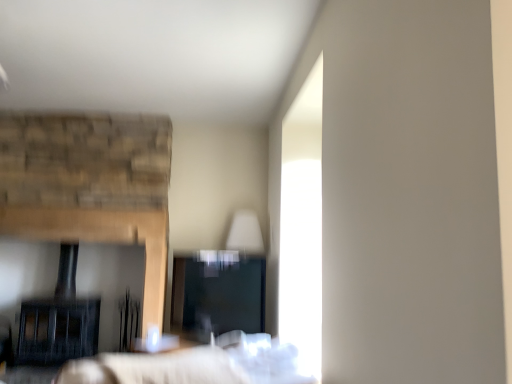
Question: From the image's perspective, is black matte fireplace at left over white fabric bed at center?

Choices:
 (A) yes
 (B) no

Answer: (B)

Question: Can you confirm if black matte fireplace at left is smaller than white fabric bed at center?

Choices:
 (A) yes
 (B) no

Answer: (B)

Question: Does black matte fireplace at left appear on the right side of white fabric bed at center?

Choices:
 (A) yes
 (B) no

Answer: (B)

Question: Considering the relative sizes of black matte fireplace at left and white fabric bed at center in the image provided, is black matte fireplace at left bigger than white fabric bed at center?

Choices:
 (A) yes
 (B) no

Answer: (A)

Question: Can you confirm if black matte fireplace at left is wider than white fabric bed at center?

Choices:
 (A) yes
 (B) no

Answer: (B)

Question: Is black matte fireplace at left next to white fabric bed at center?

Choices:
 (A) no
 (B) yes

Answer: (A)

Question: From a real-world perspective, is white fabric bed at center on black matte fireplace at left?

Choices:
 (A) yes
 (B) no

Answer: (B)

Question: Is white fabric bed at center at the left side of black matte fireplace at left?

Choices:
 (A) yes
 (B) no

Answer: (B)

Question: From a real-world perspective, is white fabric bed at center physically below black matte fireplace at left?

Choices:
 (A) no
 (B) yes

Answer: (B)

Question: Does white fabric bed at center come behind black matte fireplace at left?

Choices:
 (A) no
 (B) yes

Answer: (A)

Question: Can you confirm if white fabric bed at center is smaller than black matte fireplace at left?

Choices:
 (A) yes
 (B) no

Answer: (A)

Question: Does white fabric bed at center have a lesser width compared to black matte fireplace at left?

Choices:
 (A) no
 (B) yes

Answer: (A)

Question: Considering the positions of black matte fireplace at left and white fabric bed at center in the image, is black matte fireplace at left wider or thinner than white fabric bed at center?

Choices:
 (A) thin
 (B) wide

Answer: (A)